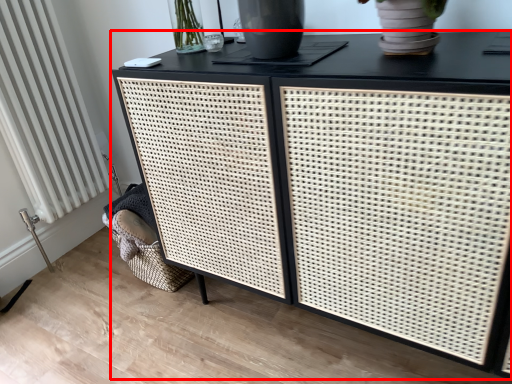
Question: Considering the relative positions of table (annotated by the red box) and radiator in the image provided, where is table (annotated by the red box) located with respect to the staircase?

Choices:
 (A) right
 (B) left

Answer: (A)